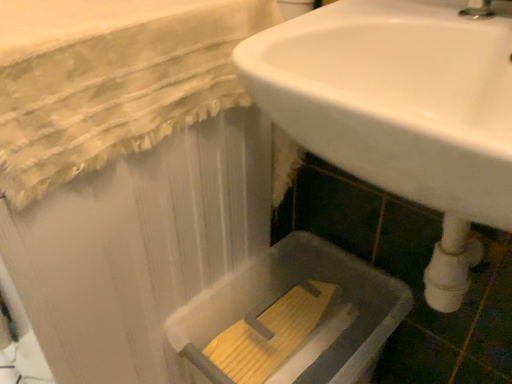
Describe the element at coordinates (291, 317) in the screenshot. Image resolution: width=512 pixels, height=384 pixels. I see `translucent plastic bath at lower right` at that location.

Where is `translucent plastic bath at lower right`? The height and width of the screenshot is (384, 512). translucent plastic bath at lower right is located at coordinates (291, 317).

What do you see at coordinates (396, 98) in the screenshot? The image size is (512, 384). I see `white glossy sink at center` at bounding box center [396, 98].

Measure the distance between point (289, 39) and camera.

Point (289, 39) and camera are 22.87 inches apart.

Where is `white glossy sink at center`? The image size is (512, 384). white glossy sink at center is located at coordinates (396, 98).

What are the coordinates of `translucent plastic bath at lower right` in the screenshot? It's located at (291, 317).

Is translucent plastic bath at lower right to the right of white glossy sink at center from the viewer's perspective?

Incorrect, translucent plastic bath at lower right is not on the right side of white glossy sink at center.

Does translucent plastic bath at lower right come in front of white glossy sink at center?

No, translucent plastic bath at lower right is further to the viewer.

Does point (230, 326) come behind point (477, 141)?

Yes, it is.

In the scene shown: From the image's perspective, between translucent plastic bath at lower right and white glossy sink at center, which one is located above?

white glossy sink at center.

From a real-world perspective, between translucent plastic bath at lower right and white glossy sink at center, who is vertically lower?

In real-world perspective, translucent plastic bath at lower right is lower.

Which object is wider, translucent plastic bath at lower right or white glossy sink at center?

translucent plastic bath at lower right is wider.

Considering the sizes of translucent plastic bath at lower right and white glossy sink at center in the image, is translucent plastic bath at lower right taller or shorter than white glossy sink at center?

Clearly, translucent plastic bath at lower right is taller compared to white glossy sink at center.

In terms of size, does translucent plastic bath at lower right appear bigger or smaller than white glossy sink at center?

Considering their sizes, translucent plastic bath at lower right takes up less space than white glossy sink at center.

Does translucent plastic bath at lower right contain white glossy sink at center?

No, white glossy sink at center is not a part of translucent plastic bath at lower right.

Are translucent plastic bath at lower right and white glossy sink at center located far from each other?

No.

Is white glossy sink at center at the back of translucent plastic bath at lower right?

No, white glossy sink at center is not at the back of translucent plastic bath at lower right.

The image size is (512, 384). Find the location of `bath behind the white glossy sink at center`. bath behind the white glossy sink at center is located at coordinates (291, 317).

Is white glossy sink at center to the left or to the right of translucent plastic bath at lower right in the image?

From the image, it's evident that white glossy sink at center is to the right of translucent plastic bath at lower right.

Relative to translucent plastic bath at lower right, is white glossy sink at center in front or behind?

Clearly, white glossy sink at center is in front of translucent plastic bath at lower right.

Considering the positions of points (292, 77) and (367, 306), is point (292, 77) closer to camera compared to point (367, 306)?

Yes, point (292, 77) is in front of point (367, 306).

From the image's perspective, between white glossy sink at center and translucent plastic bath at lower right, who is located below?

translucent plastic bath at lower right, from the image's perspective.

From the picture: From a real-world perspective, between white glossy sink at center and translucent plastic bath at lower right, who is vertically lower?

translucent plastic bath at lower right is physically lower.

Considering the sizes of objects white glossy sink at center and translucent plastic bath at lower right in the image provided, who is wider, white glossy sink at center or translucent plastic bath at lower right?

With larger width is translucent plastic bath at lower right.

Is white glossy sink at center taller or shorter than translucent plastic bath at lower right?

Considering their sizes, white glossy sink at center has less height than translucent plastic bath at lower right.

Can you confirm if white glossy sink at center is bigger than translucent plastic bath at lower right?

Correct, white glossy sink at center is larger in size than translucent plastic bath at lower right.

Is white glossy sink at center not within translucent plastic bath at lower right?

Yes, white glossy sink at center is located beyond the bounds of translucent plastic bath at lower right.

Looking at this image, is white glossy sink at center far from translucent plastic bath at lower right?

That's not correct — white glossy sink at center is a little close to translucent plastic bath at lower right.

Is translucent plastic bath at lower right at the back of white glossy sink at center?

No.

How many degrees apart are the facing directions of white glossy sink at center and translucent plastic bath at lower right?

0.000931 degrees separate the facing orientations of white glossy sink at center and translucent plastic bath at lower right.

The image size is (512, 384). What are the coordinates of `bath lying below the white glossy sink at center (from the image's perspective)` in the screenshot? It's located at (291, 317).

At what (x,y) coordinates should I click in order to perform the action: click on bath that appears on the left of white glossy sink at center. Please return your answer as a coordinate pair (x, y). This screenshot has width=512, height=384. Looking at the image, I should click on (291, 317).

Where is `sink in front of the translucent plastic bath at lower right`? The height and width of the screenshot is (384, 512). sink in front of the translucent plastic bath at lower right is located at coordinates (396, 98).